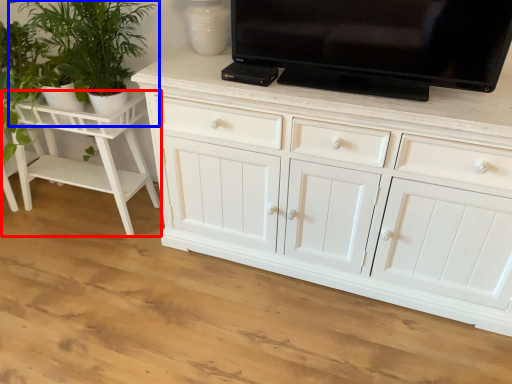
Question: Which object is further to the camera taking this photo, vanity (highlighted by a red box) or houseplant (highlighted by a blue box)?

Choices:
 (A) vanity
 (B) houseplant

Answer: (A)